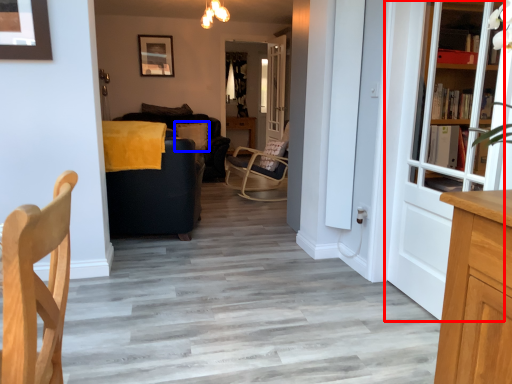
Question: Which of the following is the closest to the observer, door (highlighted by a red box) or pillow (highlighted by a blue box)?

Choices:
 (A) door
 (B) pillow

Answer: (A)